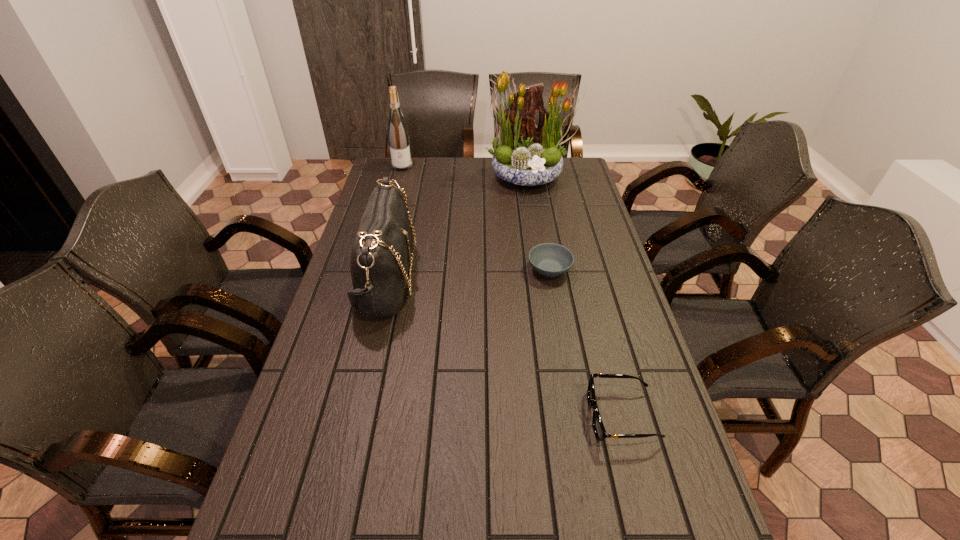
In order to click on blank region between the flower arrangement and the third tallest object in this screenshot , I will do [457, 228].

Where is `vacant space that's between the nearest object and the third tallest object`? This screenshot has width=960, height=540. vacant space that's between the nearest object and the third tallest object is located at coordinates (504, 348).

Identify the location of unoccupied area between the soup bowl and the third shortest object. (468, 274).

Select which object is the fourth closest to the handbag. Please provide its 2D coordinates. Your answer should be formatted as a tuple, i.e. [(x, y)], where the tuple contains the x and y coordinates of a point satisfying the conditions above.

[(598, 427)]

Locate an element on the screen. The width and height of the screenshot is (960, 540). object that is the closest to the wine bottle is located at coordinates (525, 154).

The image size is (960, 540). I want to click on vacant space that satisfies the following two spatial constraints: 1. on the front-facing side of the soup bowl; 2. on the left side of the flower arrangement, so click(543, 269).

Where is `blank area in the image that satisfies the following two spatial constraints: 1. on the front-facing side of the flower arrangement; 2. on the right side of the soup bowl`? blank area in the image that satisfies the following two spatial constraints: 1. on the front-facing side of the flower arrangement; 2. on the right side of the soup bowl is located at coordinates (543, 269).